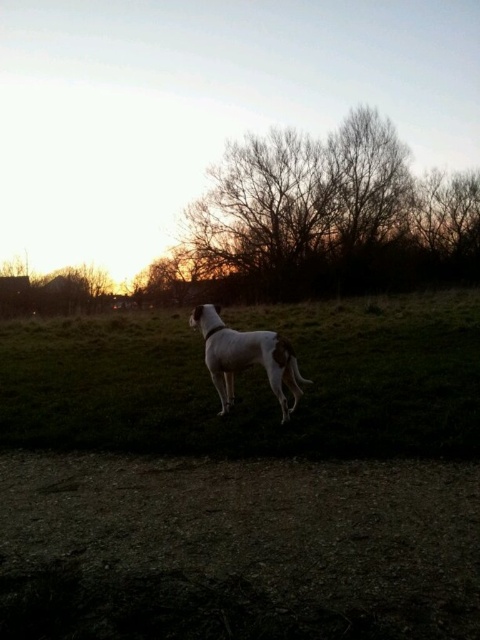
Question: Which point is closer to the camera?

Choices:
 (A) (455, 326)
 (B) (288, 349)

Answer: (B)

Question: Is bare branches at upper center below white fur dog at center?

Choices:
 (A) no
 (B) yes

Answer: (A)

Question: Can you confirm if bare branches at upper center is thinner than white fur dog at center?

Choices:
 (A) yes
 (B) no

Answer: (B)

Question: Which point appears farthest from the camera in this image?

Choices:
 (A) (226, 381)
 (B) (440, 349)

Answer: (B)

Question: Does bare branches at upper center have a greater width compared to white fur dog at center?

Choices:
 (A) no
 (B) yes

Answer: (B)

Question: Based on their relative distances, which object is nearer to the green grass at center?

Choices:
 (A) white fur dog at center
 (B) bare branches at upper center

Answer: (A)